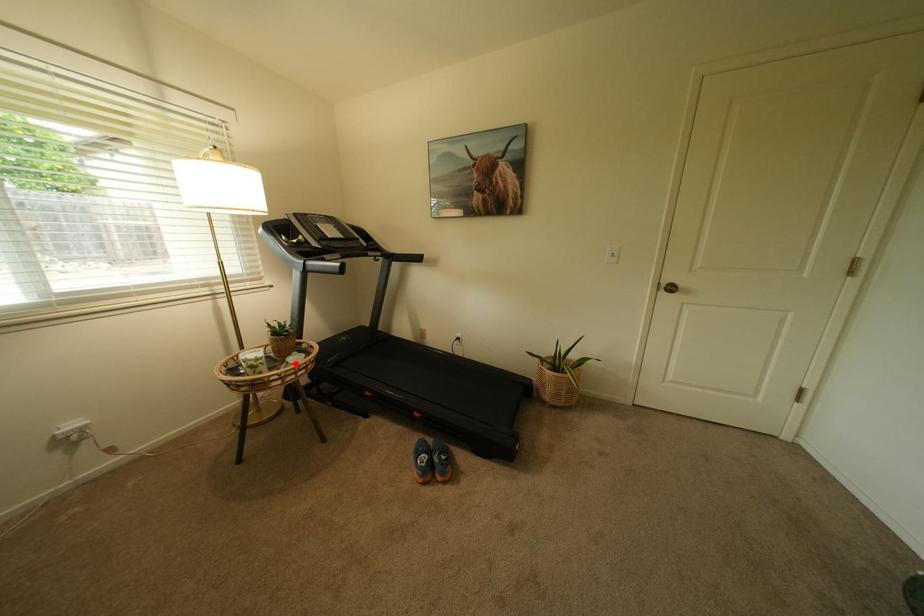
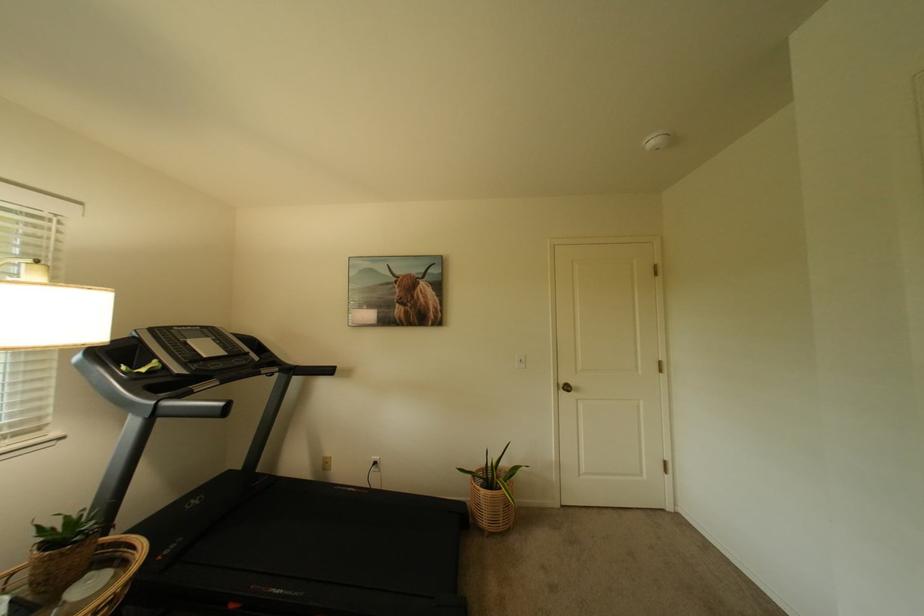
The point at the highlighted location is marked in the first image. Where is the corresponding point in the second image?

(73, 605)